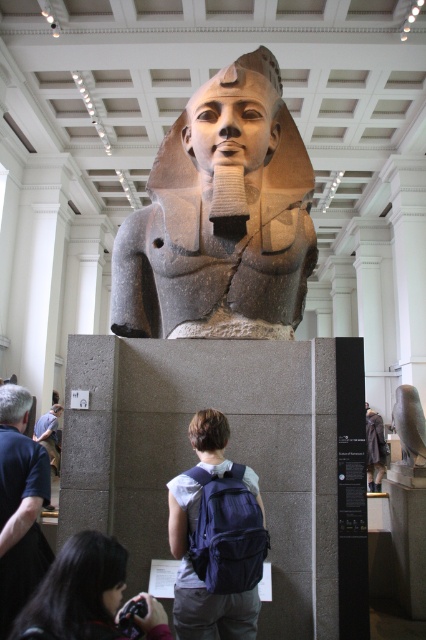
You are standing in the museum and see the fuzzy gray coat at lower right and the gray hair at upper left. Which object is farther away from you?

The fuzzy gray coat at lower right is 20.99 meters away from the gray hair at upper left, so it is farther away from you.

You are an art student observing the ancient Egyptian statue. You notice two features on the statue. One is the brown matte hair at center and the other is the fuzzy gray coat at lower right. Which of these features is shorter in height?

The brown matte hair at center is shorter in height compared to the fuzzy gray coat at lower right.

You are an art conservator examining the statue. You notice two materials on the statue. The brown matte hair at center and the fuzzy gray coat at lower right. Which material appears to have a greater thickness?

The fuzzy gray coat at lower right is thicker than the brown matte hair at center.